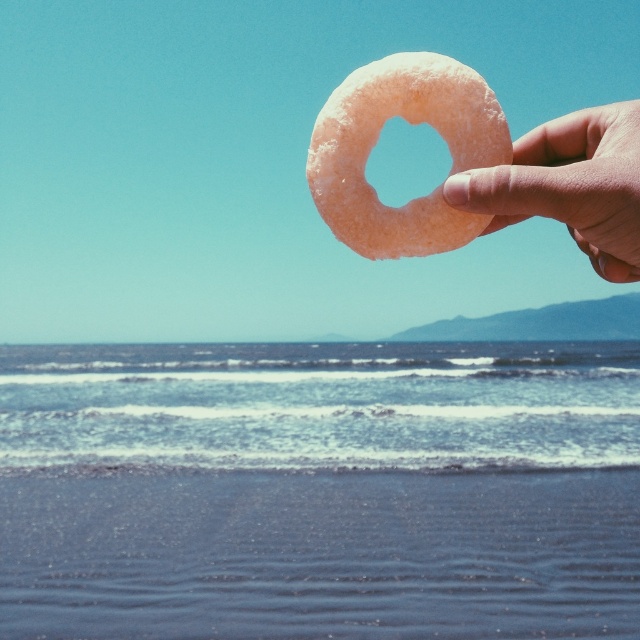
Is sandy beach at lower left smaller than sugar-coated donut at upper center?

No.

What do you see at coordinates (320, 554) in the screenshot? The height and width of the screenshot is (640, 640). I see `sandy beach at lower left` at bounding box center [320, 554].

The image size is (640, 640). I want to click on sandy beach at lower left, so click(x=320, y=554).

At what (x,y) coordinates should I click in order to perform the action: click on sandy beach at lower left. Please return your answer as a coordinate pair (x, y). The height and width of the screenshot is (640, 640). Looking at the image, I should click on (320, 554).

Which is behind, point (420, 234) or point (588, 228)?

The point (420, 234) is behind.

Between sugar-coated donut at upper center and slightly pinkish matte donut at upper right, which one has less height?

With less height is sugar-coated donut at upper center.

Is point (417, 80) less distant than point (544, 198)?

No, (417, 80) is behind (544, 198).

Where is `sugar-coated donut at upper center`? The width and height of the screenshot is (640, 640). sugar-coated donut at upper center is located at coordinates (376, 140).

Is point (116, 547) in front of point (493, 196)?

No, it is not.

Between sandy beach at lower left and slightly pinkish matte donut at upper right, which one has less height?

Standing shorter between the two is sandy beach at lower left.

Who is more forward, (301, 563) or (570, 227)?

Positioned in front is point (570, 227).

You are a GUI agent. You are given a task and a screenshot of the screen. Output one action in this format:
    pyautogui.click(x=<x>, y=<y>)
    Task: Click on the sandy beach at lower left
    Image resolution: width=640 pixels, height=640 pixels.
    Given the screenshot: What is the action you would take?
    pyautogui.click(x=320, y=554)